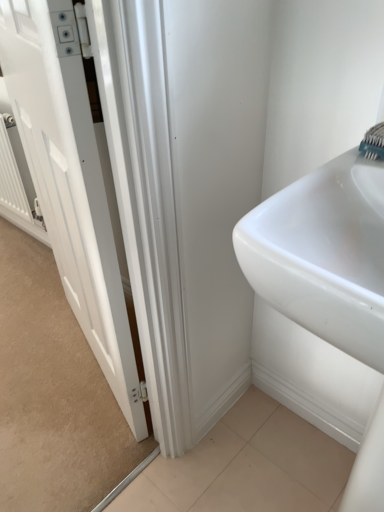
Question: Can we say white glossy door at left lies outside white metallic radiator at left?

Choices:
 (A) yes
 (B) no

Answer: (A)

Question: Is white glossy door at left at the right side of white metallic radiator at left?

Choices:
 (A) no
 (B) yes

Answer: (B)

Question: Would you say white glossy door at left contains white metallic radiator at left?

Choices:
 (A) no
 (B) yes

Answer: (A)

Question: Is white glossy door at left positioned with its back to white metallic radiator at left?

Choices:
 (A) yes
 (B) no

Answer: (B)

Question: From the image's perspective, is white glossy door at left under white metallic radiator at left?

Choices:
 (A) no
 (B) yes

Answer: (B)

Question: Does white glossy door at left turn towards white metallic radiator at left?

Choices:
 (A) no
 (B) yes

Answer: (A)

Question: Is teal plastic toothbrush at upper right not inside white metallic radiator at left?

Choices:
 (A) no
 (B) yes

Answer: (B)

Question: Considering the relative sizes of teal plastic toothbrush at upper right and white metallic radiator at left in the image provided, is teal plastic toothbrush at upper right shorter than white metallic radiator at left?

Choices:
 (A) no
 (B) yes

Answer: (B)

Question: Is teal plastic toothbrush at upper right positioned behind white metallic radiator at left?

Choices:
 (A) yes
 (B) no

Answer: (B)

Question: From the image's perspective, does teal plastic toothbrush at upper right appear lower than white metallic radiator at left?

Choices:
 (A) no
 (B) yes

Answer: (B)

Question: Is teal plastic toothbrush at upper right at the left side of white metallic radiator at left?

Choices:
 (A) yes
 (B) no

Answer: (B)

Question: Could you tell me if teal plastic toothbrush at upper right is turned towards white metallic radiator at left?

Choices:
 (A) yes
 (B) no

Answer: (B)

Question: Is white metallic radiator at left looking in the opposite direction of white glossy door at left?

Choices:
 (A) no
 (B) yes

Answer: (A)